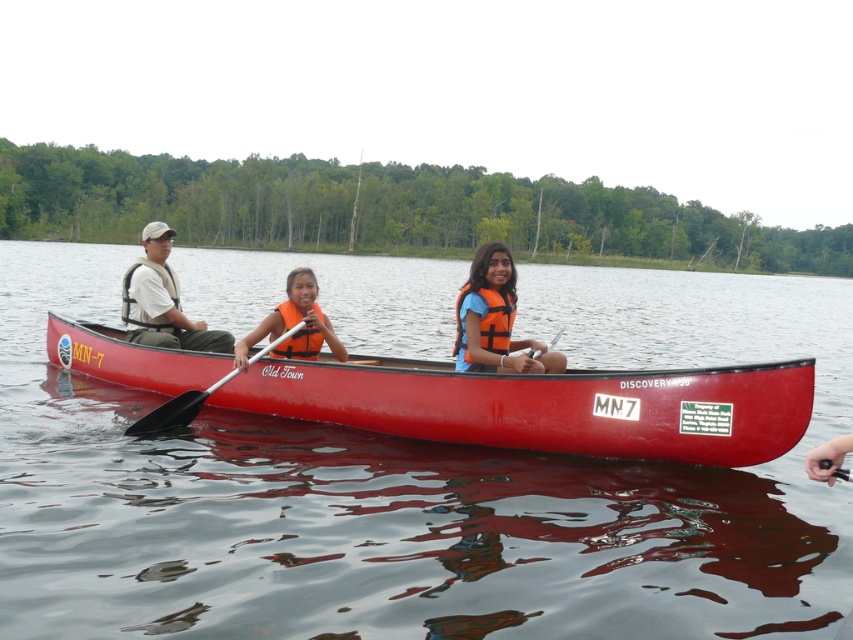
You are a safety inspector checking life vests on a canoe. The orange life vest at center is worn by a child, and the matte white life vest at left is worn by an adult. According to safety regulations, which life vest should be thicker for proper buoyancy?

The matte white life vest at left should be thicker because the orange life vest at center is thinner than it, and adults typically require more buoyancy than children.

You are a safety inspector checking the life vest positions in the canoe. According to the image, is the orange life vest at center located to the right or left of the matte white life vest at left?

The orange life vest at center is to the right of the matte white life vest at left.